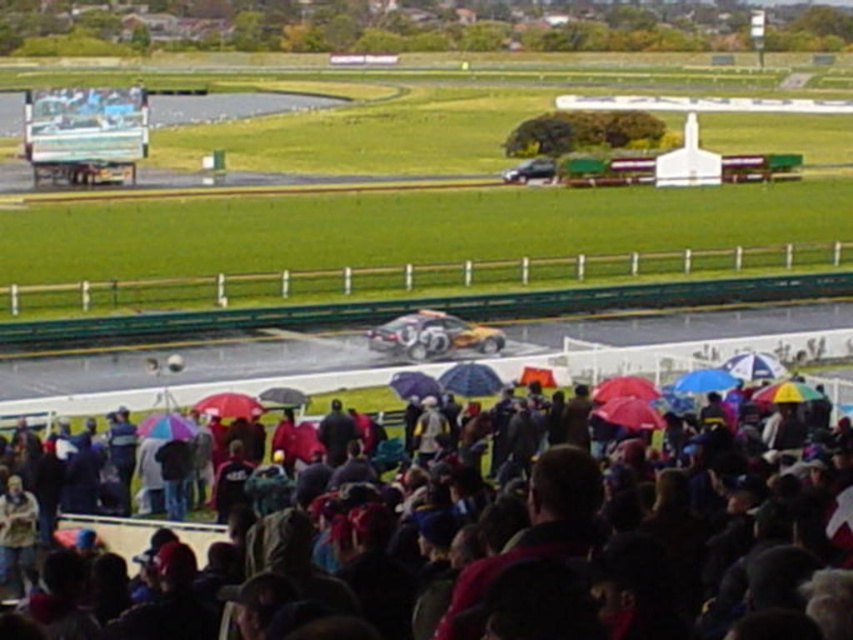
You are a photographer at the motorsport event and want to capture a photo of the racing car. However, you notice a denim jacket at lower left blocking your view. Where exactly is the denim jacket located in the image?

The denim jacket at lower left is located at point [16,536] in the image.